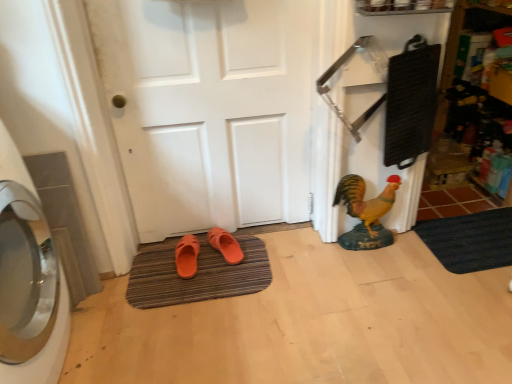
Question: Can you confirm if silver metallic washing machine at left is bigger than shiny yellow statue at right?

Choices:
 (A) yes
 (B) no

Answer: (A)

Question: Can you confirm if silver metallic washing machine at left is wider than shiny yellow statue at right?

Choices:
 (A) yes
 (B) no

Answer: (A)

Question: Is silver metallic washing machine at left looking in the opposite direction of shiny yellow statue at right?

Choices:
 (A) no
 (B) yes

Answer: (A)

Question: Are silver metallic washing machine at left and shiny yellow statue at right making contact?

Choices:
 (A) yes
 (B) no

Answer: (B)

Question: Would you say silver metallic washing machine at left contains shiny yellow statue at right?

Choices:
 (A) yes
 (B) no

Answer: (B)

Question: Is silver metallic washing machine at left at the right side of shiny yellow statue at right?

Choices:
 (A) yes
 (B) no

Answer: (B)

Question: Is silver metallic washing machine at left positioned with its back to orange matte slippers at center, arranged as the 2th footwear when viewed from the left?

Choices:
 (A) no
 (B) yes

Answer: (A)

Question: Is the depth of silver metallic washing machine at left greater than that of orange matte slippers at center, arranged as the 2th footwear when viewed from the left?

Choices:
 (A) yes
 (B) no

Answer: (B)

Question: Would you say silver metallic washing machine at left is outside orange matte slippers at center, the 1th footwear viewed from the right?

Choices:
 (A) no
 (B) yes

Answer: (B)

Question: From the image's perspective, is silver metallic washing machine at left located beneath orange matte slippers at center, arranged as the 2th footwear when viewed from the left?

Choices:
 (A) yes
 (B) no

Answer: (A)

Question: Does silver metallic washing machine at left have a lesser height compared to orange matte slippers at center, the 1th footwear viewed from the right?

Choices:
 (A) no
 (B) yes

Answer: (A)

Question: Can you confirm if silver metallic washing machine at left is wider than orange matte slippers at center, the 1th footwear viewed from the right?

Choices:
 (A) yes
 (B) no

Answer: (A)

Question: Are orange matte slippers at center, arranged as the 2th footwear when viewed from the left, and black rubber bath mat at lower right, marked as the second bath mat in a left-to-right arrangement, making contact?

Choices:
 (A) no
 (B) yes

Answer: (A)